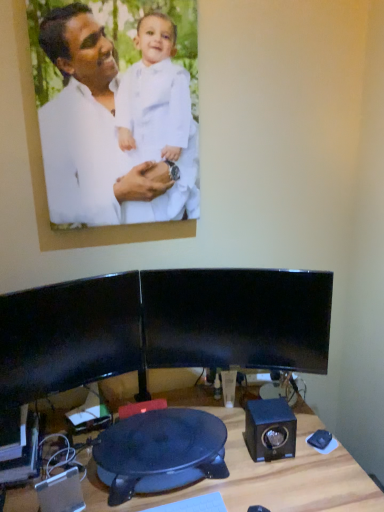
This screenshot has width=384, height=512. I want to click on vacant area that lies between blue matte speaker at lower right, which appears as the 1th speaker when viewed from the right, and black plastic swivel chair at center, so click(243, 450).